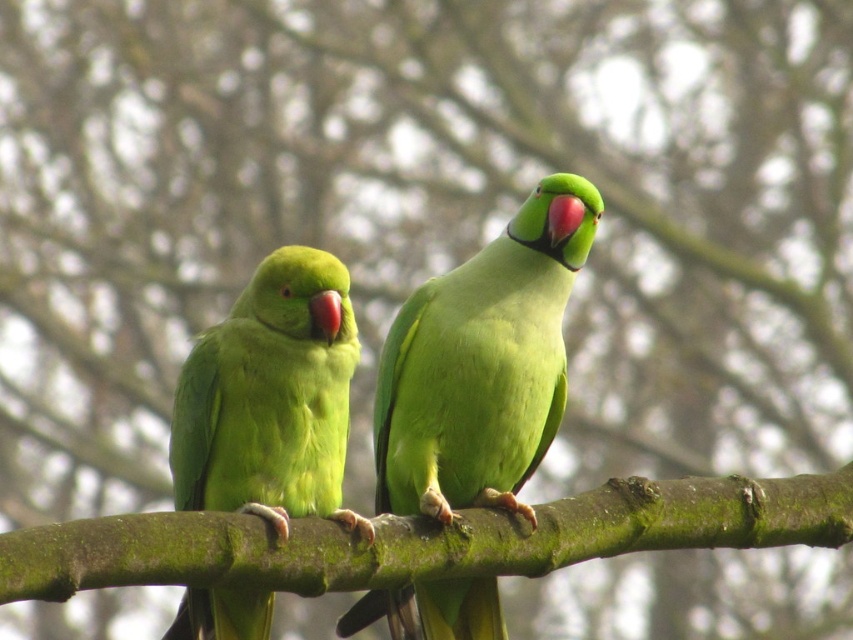
Question: Considering the relative positions of green matte parrot at center and green matte parrot at left in the image provided, where is green matte parrot at center located with respect to green matte parrot at left?

Choices:
 (A) above
 (B) below

Answer: (A)

Question: Which object appears closest to the camera in this image?

Choices:
 (A) green mossy branch at center
 (B) green matte parrot at left

Answer: (A)

Question: Which point is farther to the camera?

Choices:
 (A) green matte parrot at center
 (B) green mossy branch at center
 (C) green matte parrot at left

Answer: (A)

Question: Among these points, which one is nearest to the camera?

Choices:
 (A) (451, 417)
 (B) (538, 545)

Answer: (B)

Question: Is green matte parrot at center wider than green matte parrot at left?

Choices:
 (A) no
 (B) yes

Answer: (B)

Question: Can you confirm if green matte parrot at center is wider than green matte parrot at left?

Choices:
 (A) no
 (B) yes

Answer: (B)